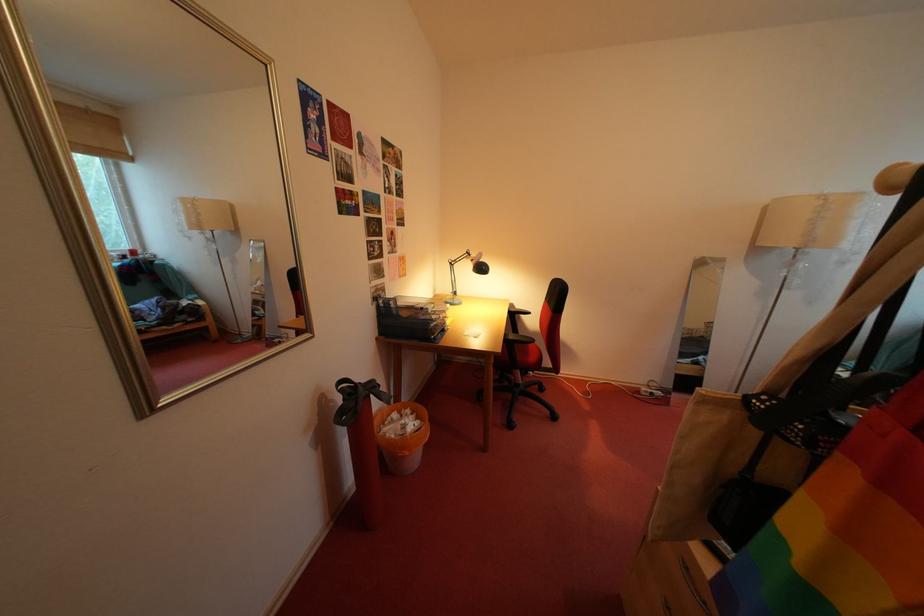
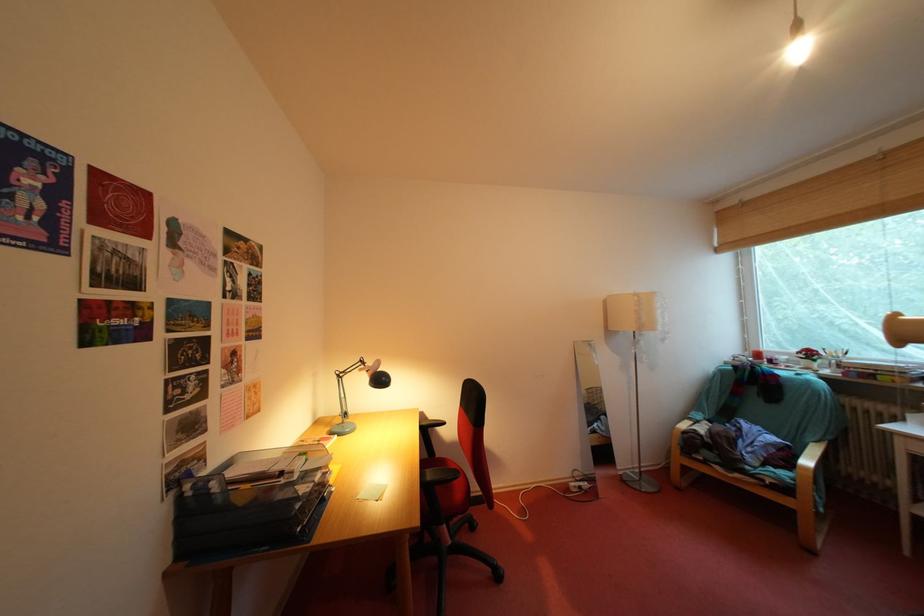
How did the camera likely rotate?

The camera rotated toward right-up.